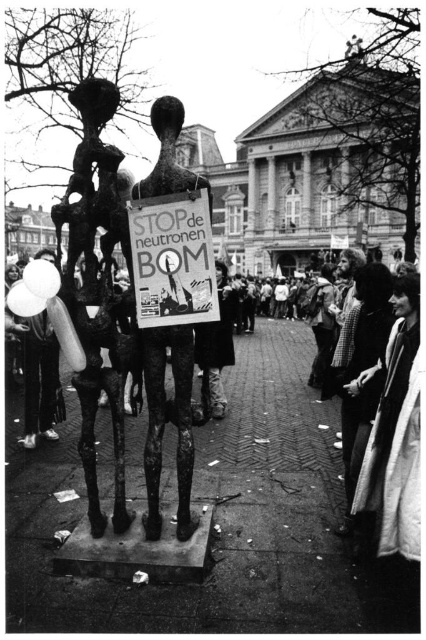
Question: Does bronze sculpture at center have a smaller size compared to metallic poster at center?

Choices:
 (A) no
 (B) yes

Answer: (A)

Question: Is bronze sculpture at center smaller than metallic poster at center?

Choices:
 (A) yes
 (B) no

Answer: (B)

Question: Among these objects, which one is nearest to the camera?

Choices:
 (A) bronze sculpture at center
 (B) metallic poster at center

Answer: (A)

Question: Is bronze sculpture at center thinner than metallic poster at center?

Choices:
 (A) yes
 (B) no

Answer: (A)

Question: Among these objects, which one is farthest from the camera?

Choices:
 (A) bronze sculpture at center
 (B) metallic poster at center

Answer: (B)